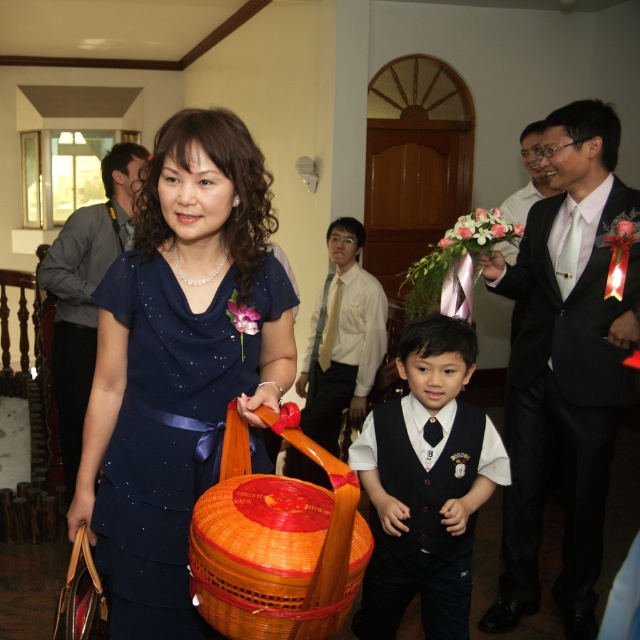
You are organizing a charity event and need to decide which outfit to choose between the navy blue satin dress at center and the matte gray shirt at upper left based on their width. Which one is narrower?

The navy blue satin dress at center is thinner than the matte gray shirt at upper left, so the navy blue satin dress at center is narrower.

You are a photographer at the event and need to ensure the dress is visible in the photo. Since the navy blue satin dress at center and the matte black vest at center are overlapping, which one is covering the other?

The navy blue satin dress at center is positioned over matte black vest at center, so the dress is covering the vest.